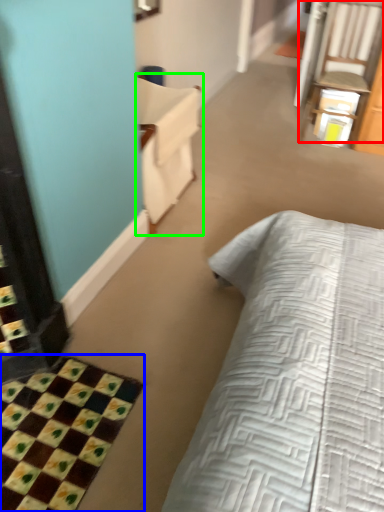
Question: Based on their relative distances, which object is farther from chair (highlighted by a red box)? Choose from bath mat (highlighted by a blue box) and armchair (highlighted by a green box).

Choices:
 (A) bath mat
 (B) armchair

Answer: (A)